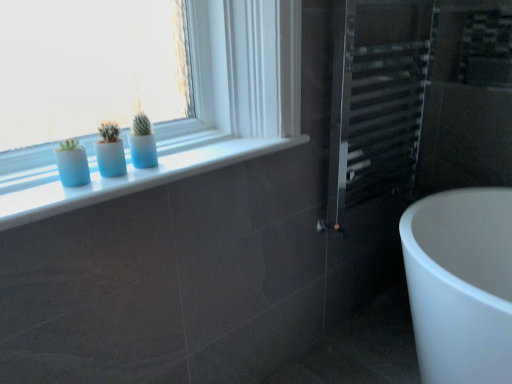
Describe the element at coordinates (372, 141) in the screenshot. The height and width of the screenshot is (384, 512). I see `metallic silver radiator at right` at that location.

What is the approximate height of metallic silver radiator at right?

The height of metallic silver radiator at right is 84.52 centimeters.

Where is `matte blue vase at left`? The height and width of the screenshot is (384, 512). matte blue vase at left is located at coordinates (73, 167).

What do you see at coordinates (134, 176) in the screenshot?
I see `white glossy window sill at upper center` at bounding box center [134, 176].

What is the approximate height of white glossy window sill at upper center?

white glossy window sill at upper center is 1.35 inches in height.

Find the location of `metallic silver radiator at right`. metallic silver radiator at right is located at coordinates (372, 141).

Could you tell me if metallic silver radiator at right is facing matte blue vase at left?

No, metallic silver radiator at right does not turn towards matte blue vase at left.

Considering the sizes of objects metallic silver radiator at right and matte blue vase at left in the image provided, who is thinner, metallic silver radiator at right or matte blue vase at left?

With smaller width is matte blue vase at left.

Is metallic silver radiator at right placed right next to matte blue vase at left?

No.

Between metallic silver radiator at right and matte blue vase at left, which one has smaller size?

matte blue vase at left.

Is white glossy window sill at upper center taller than metallic silver radiator at right?

No.

Is white glossy window sill at upper center oriented away from metallic silver radiator at right?

white glossy window sill at upper center is not turned away from metallic silver radiator at right.

In terms of width, does white glossy window sill at upper center look wider or thinner when compared to metallic silver radiator at right?

white glossy window sill at upper center is wider than metallic silver radiator at right.

From a real-world perspective, which is physically above, white glossy window sill at upper center or metallic silver radiator at right?

white glossy window sill at upper center, from a real-world perspective.

Who is taller, white glossy window sill at upper center or matte blue vase at left?

Standing taller between the two is matte blue vase at left.

How far apart are white glossy window sill at upper center and matte blue vase at left?

A distance of 6.76 inches exists between white glossy window sill at upper center and matte blue vase at left.

Which object is positioned more to the right, white glossy window sill at upper center or matte blue vase at left?

white glossy window sill at upper center.

From the picture: Which is in front, white glossy window sill at upper center or matte blue vase at left?

white glossy window sill at upper center is more forward.

From a real-world perspective, is matte blue vase at left positioned above or below metallic silver radiator at right?

matte blue vase at left is above metallic silver radiator at right.

Which of these two, matte blue vase at left or metallic silver radiator at right, is wider?

Wider between the two is metallic silver radiator at right.

Image resolution: width=512 pixels, height=384 pixels. In the image, there is a matte blue vase at left. Find the location of `screen door above it (from the image's perspective)`. screen door above it (from the image's perspective) is located at coordinates (372, 141).

Can you confirm if matte blue vase at left is shorter than metallic silver radiator at right?

Yes.

Locate an element on the screen. The width and height of the screenshot is (512, 384). window sill that is on the right side of matte blue vase at left is located at coordinates (134, 176).

Based on the photo, is matte blue vase at left not near white glossy window sill at upper center?

No.

Who is smaller, matte blue vase at left or white glossy window sill at upper center?

With smaller size is matte blue vase at left.

Between metallic silver radiator at right and white glossy window sill at upper center, which one has larger width?

With larger width is white glossy window sill at upper center.

What's the angular difference between metallic silver radiator at right and white glossy window sill at upper center's facing directions?

0.147 degrees separate the facing orientations of metallic silver radiator at right and white glossy window sill at upper center.

Who is smaller, metallic silver radiator at right or white glossy window sill at upper center?

With smaller size is white glossy window sill at upper center.

Which is less distant, (412, 81) or (0, 208)?

Clearly, point (412, 81) is more distant from the camera than point (0, 208).

Find the location of a particular element. This screenshot has width=512, height=384. screen door below the matte blue vase at left (from a real-world perspective) is located at coordinates (372, 141).

Image resolution: width=512 pixels, height=384 pixels. I want to click on window sill on the left side of metallic silver radiator at right, so click(134, 176).

When comparing their distances from matte blue vase at left, does white glossy window sill at upper center or metallic silver radiator at right seem further?

metallic silver radiator at right is further to matte blue vase at left.

When comparing their distances from matte blue vase at left, does metallic silver radiator at right or white glossy window sill at upper center seem further?

The object further to matte blue vase at left is metallic silver radiator at right.

Considering their positions, is matte blue vase at left positioned further to metallic silver radiator at right than white glossy window sill at upper center?

Among the two, matte blue vase at left is located further to metallic silver radiator at right.

Estimate the real-world distances between objects in this image. Which object is further from white glossy window sill at upper center, matte blue vase at left or metallic silver radiator at right?

Based on the image, metallic silver radiator at right appears to be further to white glossy window sill at upper center.

Considering their positions, is white glossy window sill at upper center positioned closer to metallic silver radiator at right than matte blue vase at left?

white glossy window sill at upper center is closer to metallic silver radiator at right.

From the image, which object appears to be nearer to white glossy window sill at upper center, metallic silver radiator at right or matte blue vase at left?

matte blue vase at left lies closer to white glossy window sill at upper center than the other object.

Identify the location of window sill situated between matte blue vase at left and metallic silver radiator at right from left to right. pyautogui.click(x=134, y=176).